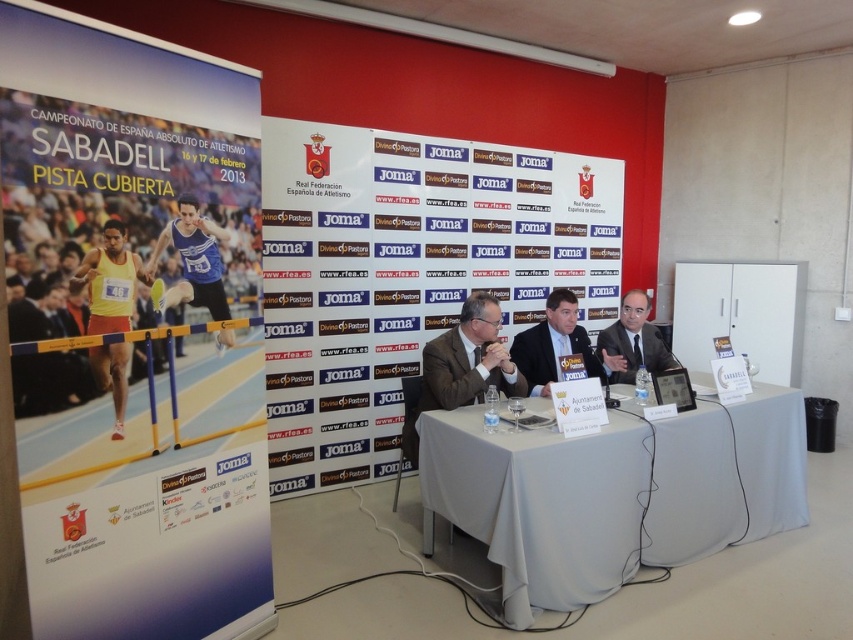
You are attending the Campeonato de Espa?a Absoluto de Atletismo press conference and notice two suits at the center of the stage. The matte brown suit at center and the matte black suit at center. Which one is positioned closer to the front of the stage?

The matte brown suit at center is closer to the viewer than the matte black suit at center, so the matte brown suit at center is positioned closer to the front of the stage.

You are a photographer at the press conference and need to capture a clear shot of the matte brown suit at center and the dark blue suit at center. Which suit is closer to the camera?

The matte brown suit at center is in front of the dark blue suit at center, so it is closer to the camera.